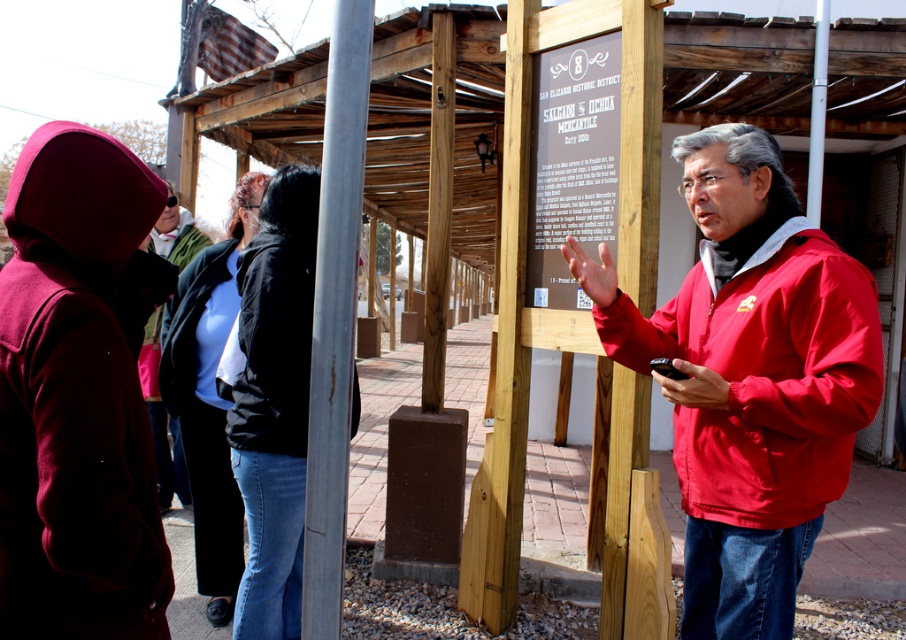
Where is `silver metallic pole at center`? The width and height of the screenshot is (906, 640). silver metallic pole at center is located at coordinates (334, 314).

Is silver metallic pole at center wider than matte black jacket at center?

No.

Measure the distance between point (x=311, y=531) and camera.

A distance of 1.80 meters exists between point (x=311, y=531) and camera.

Where is `silver metallic pole at center`? silver metallic pole at center is located at coordinates click(334, 314).

Describe the element at coordinates (76, 396) in the screenshot. This screenshot has height=640, width=906. I see `maroon woolen jacket at left` at that location.

Does maroon woolen jacket at left appear on the right side of matte black jacket at center?

Yes, maroon woolen jacket at left is to the right of matte black jacket at center.

Does point (24, 621) come farther from viewer compared to point (165, 337)?

No, it is in front of (165, 337).

Image resolution: width=906 pixels, height=640 pixels. I want to click on maroon woolen jacket at left, so click(76, 396).

Identify the location of maroon woolen jacket at left. (76, 396).

Is point (8, 506) positioned behind point (811, 128)?

That is False.

Where is `maroon woolen jacket at left`? maroon woolen jacket at left is located at coordinates (76, 396).